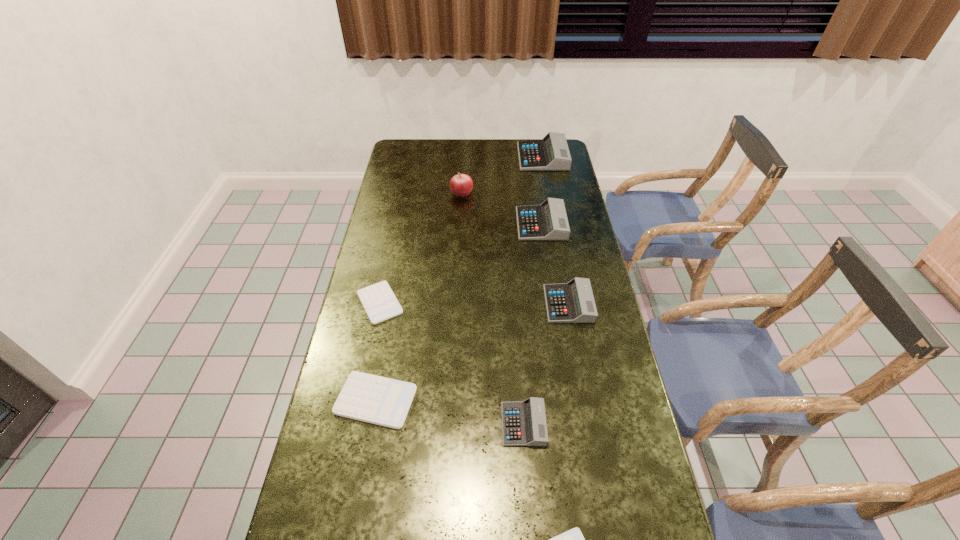
Identify the location of the second farthest object. This screenshot has height=540, width=960. (461, 185).

Where is `the third object from left to right`? the third object from left to right is located at coordinates (461, 185).

Locate an element on the screen. Image resolution: width=960 pixels, height=540 pixels. the tallest calculator is located at coordinates (551, 153).

The height and width of the screenshot is (540, 960). In order to click on the farthest gray calculator in this screenshot , I will do `click(551, 153)`.

Find the location of `the third tallest object`. the third tallest object is located at coordinates (548, 221).

The height and width of the screenshot is (540, 960). Identify the location of the second tallest calculator. (548, 221).

Locate an element on the screen. The width and height of the screenshot is (960, 540). the fourth tallest object is located at coordinates (573, 302).

The width and height of the screenshot is (960, 540). I want to click on the third farthest gray calculator, so click(x=573, y=302).

The image size is (960, 540). What are the coordinates of `the fourth shortest calculator` in the screenshot? It's located at (524, 423).

Where is `the fifth tallest object`? the fifth tallest object is located at coordinates (524, 423).